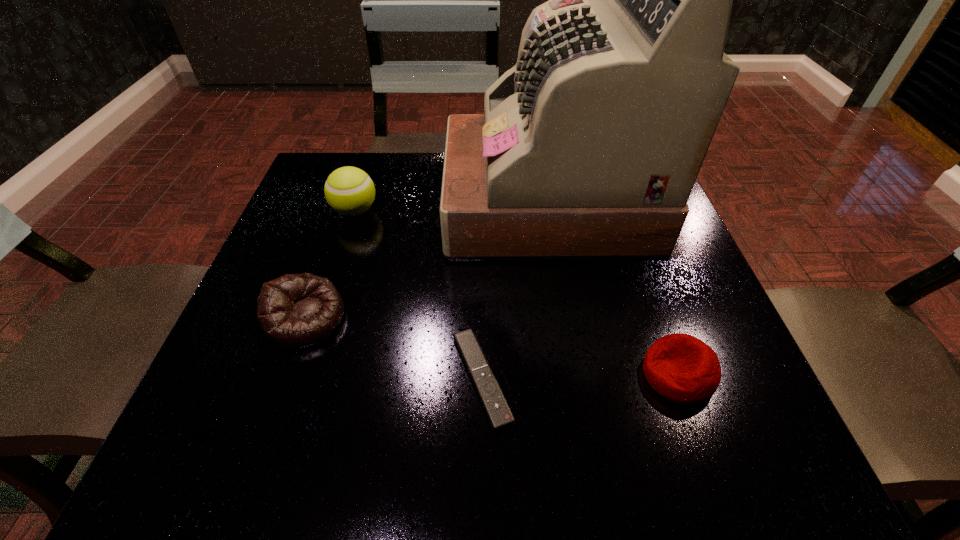
The height and width of the screenshot is (540, 960). In order to click on vacant space located 0.240m on the seat area of the right beanbag in this screenshot , I will do `click(492, 375)`.

This screenshot has height=540, width=960. I want to click on vacant region located on the seat area of the right beanbag, so click(497, 375).

I want to click on free space located 0.320m on the seat area of the right beanbag, so click(x=441, y=375).

In order to click on free spot located 0.110m on the back of the remote control in this screenshot , I will do `click(482, 286)`.

The height and width of the screenshot is (540, 960). What are the coordinates of `cash register present at the far edge` in the screenshot? It's located at (589, 147).

Where is `tennis ball positioned at the far edge`? tennis ball positioned at the far edge is located at coordinates (349, 191).

Find the location of `object that is positioned at the near edge`. object that is positioned at the near edge is located at coordinates (493, 400).

Find the location of `tennis ball that is at the left edge`. tennis ball that is at the left edge is located at coordinates (349, 191).

Where is `beanbag present at the left edge`? beanbag present at the left edge is located at coordinates (295, 311).

Locate an element on the screen. cash register that is at the right edge is located at coordinates (589, 147).